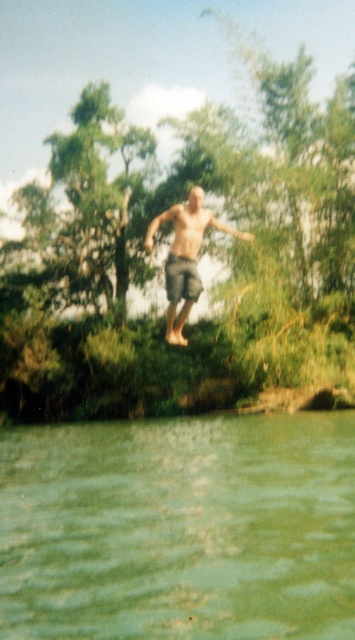
You are a lifeguard on duty and notice someone jumping into the water. Based on the image, will the green murky water at lower center be deeper than the gray cotton shorts at center when the person lands?

The green murky water at lower center is shorter than the gray cotton shorts at center, so the water will not be deeper than the shorts when the person lands.

You are a photographer analyzing the composition of this image. You notice a point at coordinates (178, 529). What object is positioned at this specific coordinate?

The green murky water at lower center is located at point (178, 529).